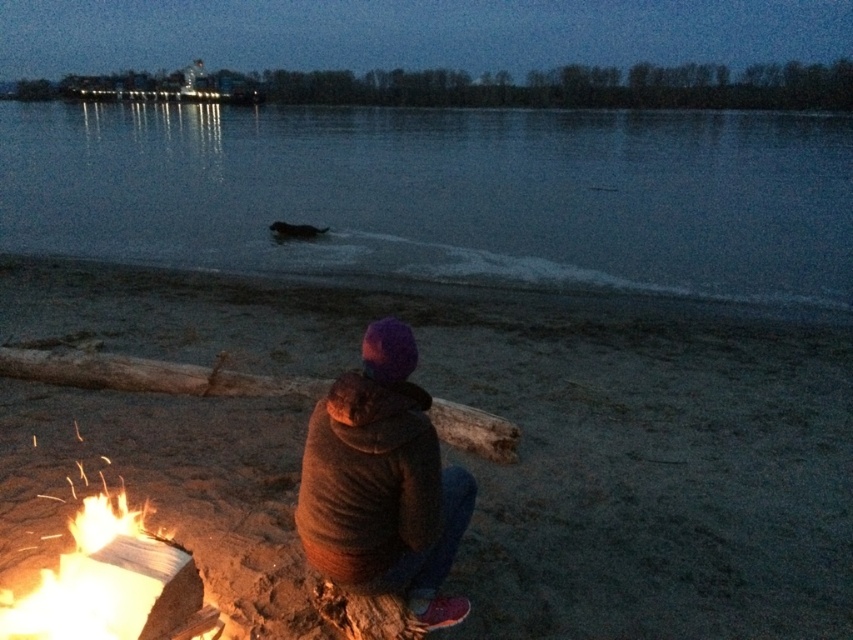
Which is above, dark water at center or flaming wood at lower left?

Positioned higher is dark water at center.

Between dark water at center and flaming wood at lower left, which one appears on the right side from the viewer's perspective?

dark water at center

Describe the element at coordinates (445, 195) in the screenshot. Image resolution: width=853 pixels, height=640 pixels. I see `dark water at center` at that location.

Locate an element on the screen. This screenshot has height=640, width=853. dark water at center is located at coordinates (445, 195).

Does purple woolen hat at center have a lesser width compared to flaming wood at lower left?

Yes.

Between point (401, 449) and point (9, 614), which one is positioned in front?

Point (401, 449) is in front.

You are a GUI agent. You are given a task and a screenshot of the screen. Output one action in this format:
    pyautogui.click(x=<x>, y=<y>)
    Task: Click on the purple woolen hat at center
    Image resolution: width=853 pixels, height=640 pixels.
    Given the screenshot: What is the action you would take?
    (x=383, y=484)

Which is above, dark water at center or purple woolen hat at center?

Positioned higher is dark water at center.

Between dark water at center and purple woolen hat at center, which one has more height?

Standing taller between the two is dark water at center.

Which is in front, point (276, 150) or point (357, 529)?

Point (357, 529) is in front.

The width and height of the screenshot is (853, 640). What are the coordinates of `dark water at center` in the screenshot? It's located at (445, 195).